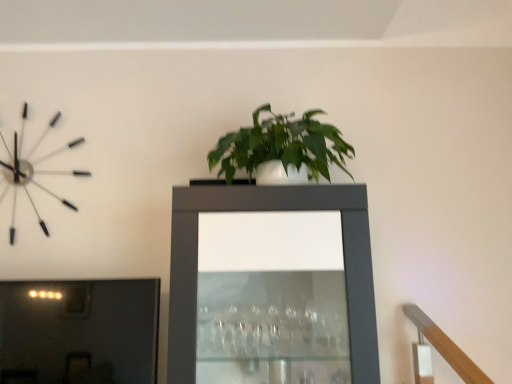
The width and height of the screenshot is (512, 384). Describe the element at coordinates (272, 210) in the screenshot. I see `matte black cabinet at center` at that location.

At what (x,y) coordinates should I click in order to perform the action: click on matte black cabinet at center. Please return your answer as a coordinate pair (x, y). This screenshot has width=512, height=384. Looking at the image, I should click on pos(272,210).

The height and width of the screenshot is (384, 512). What do you see at coordinates (33, 171) in the screenshot? I see `metallic silver clock at upper left` at bounding box center [33, 171].

Where is `metallic silver clock at upper left`? This screenshot has width=512, height=384. metallic silver clock at upper left is located at coordinates (33, 171).

This screenshot has width=512, height=384. Find the location of `matte black cabinet at center`. matte black cabinet at center is located at coordinates (272, 210).

Is metallic silver clock at upper left to the left or to the right of matte black cabinet at center in the image?

metallic silver clock at upper left is positioned on matte black cabinet at center's left side.

Considering the positions of objects metallic silver clock at upper left and matte black cabinet at center in the image provided, who is in front, metallic silver clock at upper left or matte black cabinet at center?

matte black cabinet at center is more forward.

Which is more distant, [15,198] or [181,255]?

The point [15,198] is farther.

From the image's perspective, who appears lower, metallic silver clock at upper left or matte black cabinet at center?

matte black cabinet at center is shown below in the image.

From a real-world perspective, between metallic silver clock at upper left and matte black cabinet at center, who is vertically lower?

From a 3D spatial view, matte black cabinet at center is below.

Can you confirm if metallic silver clock at upper left is wider than matte black cabinet at center?

In fact, metallic silver clock at upper left might be narrower than matte black cabinet at center.

Who is taller, metallic silver clock at upper left or matte black cabinet at center?

With more height is matte black cabinet at center.

Which of these two, metallic silver clock at upper left or matte black cabinet at center, is smaller?

Smaller between the two is metallic silver clock at upper left.

Looking at this image, is metallic silver clock at upper left inside the boundaries of matte black cabinet at center, or outside?

metallic silver clock at upper left is located beyond the bounds of matte black cabinet at center.

Is metallic silver clock at upper left placed right next to matte black cabinet at center?

No, metallic silver clock at upper left is not beside matte black cabinet at center.

Could you tell me if metallic silver clock at upper left is turned towards matte black cabinet at center?

No, metallic silver clock at upper left is not facing towards matte black cabinet at center.

Can you tell me how much metallic silver clock at upper left and matte black cabinet at center differ in facing direction?

metallic silver clock at upper left and matte black cabinet at center are facing 0.148 degrees away from each other.

The image size is (512, 384). Find the location of `wall clock positioned vertically above the matte black cabinet at center (from a real-world perspective)`. wall clock positioned vertically above the matte black cabinet at center (from a real-world perspective) is located at coordinates (33, 171).

Does matte black cabinet at center appear on the right side of metallic silver clock at upper left?

Yes, matte black cabinet at center is to the right of metallic silver clock at upper left.

Considering their positions, is matte black cabinet at center located in front of or behind metallic silver clock at upper left?

Visually, matte black cabinet at center is located in front of metallic silver clock at upper left.

Which point is more forward, (189, 272) or (42, 187)?

Positioned in front is point (189, 272).

From the image's perspective, which one is positioned higher, matte black cabinet at center or metallic silver clock at upper left?

metallic silver clock at upper left.

From a real-world perspective, does matte black cabinet at center sit lower than metallic silver clock at upper left?

Yes.

Is matte black cabinet at center wider than metallic silver clock at upper left?

A: Correct, the width of matte black cabinet at center exceeds that of metallic silver clock at upper left.

Between matte black cabinet at center and metallic silver clock at upper left, which one has less height?

With less height is metallic silver clock at upper left.

Considering the relative sizes of matte black cabinet at center and metallic silver clock at upper left in the image provided, is matte black cabinet at center smaller than metallic silver clock at upper left?

No.

Is matte black cabinet at center positioned beyond the bounds of metallic silver clock at upper left?

Absolutely, matte black cabinet at center is external to metallic silver clock at upper left.

Is the surface of matte black cabinet at center in direct contact with metallic silver clock at upper left?

No, matte black cabinet at center is not in contact with metallic silver clock at upper left.

In the scene shown: Is matte black cabinet at center looking in the opposite direction of metallic silver clock at upper left?

No, metallic silver clock at upper left is not at the back of matte black cabinet at center.

Measure the distance from matte black cabinet at center to metallic silver clock at upper left.

matte black cabinet at center is 32.97 inches away from metallic silver clock at upper left.

What are the coordinates of `tv cabinet below the metallic silver clock at upper left (from the image's perspective)` in the screenshot? It's located at (272, 210).

You are a GUI agent. You are given a task and a screenshot of the screen. Output one action in this format:
    pyautogui.click(x=<x>, y=<y>)
    Task: Click on the tv cabinet located below the metallic silver clock at upper left (from the image's perspective)
    
    Given the screenshot: What is the action you would take?
    pyautogui.click(x=272, y=210)

This screenshot has width=512, height=384. I want to click on tv cabinet that is in front of the metallic silver clock at upper left, so click(x=272, y=210).